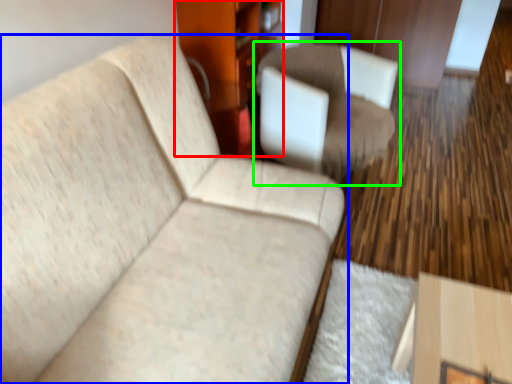
Question: Which object is the closest to the dresser (highlighted by a red box)? Choose among these: studio couch (highlighted by a blue box) or chair (highlighted by a green box).

Choices:
 (A) studio couch
 (B) chair

Answer: (B)